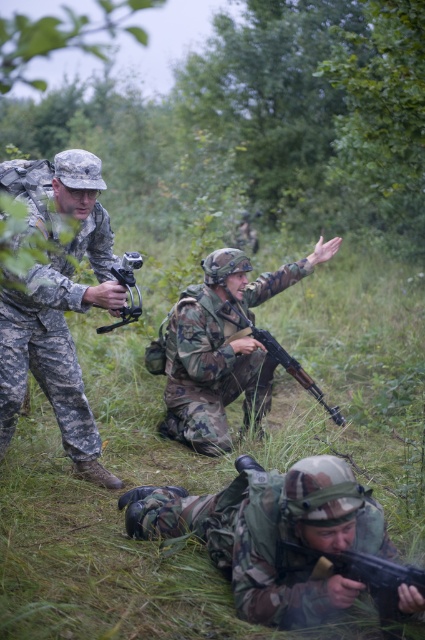
You are a drone operator observing the military exercise. You notice two points marked in the scene. Which point is closer to your drone camera? The points are point (422, 396) and point (190, 294).

Point (190, 294) is closer to the drone camera because the Objects Description states that point (422, 396) is further to the camera than point (190, 294).

Based on the scene description, can you determine if the green grass at center is positioned above or below the camouflage fabric rifle at lower center?

The green grass at center is positioned above the camouflage fabric rifle at lower center according to the provided description.